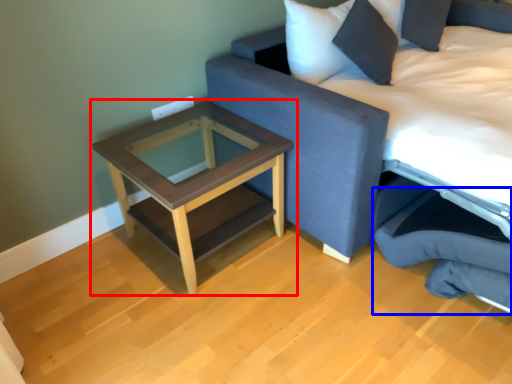
Question: Among these objects, which one is farthest to the camera, table (highlighted by a red box) or swivel chair (highlighted by a blue box)?

Choices:
 (A) table
 (B) swivel chair

Answer: (A)